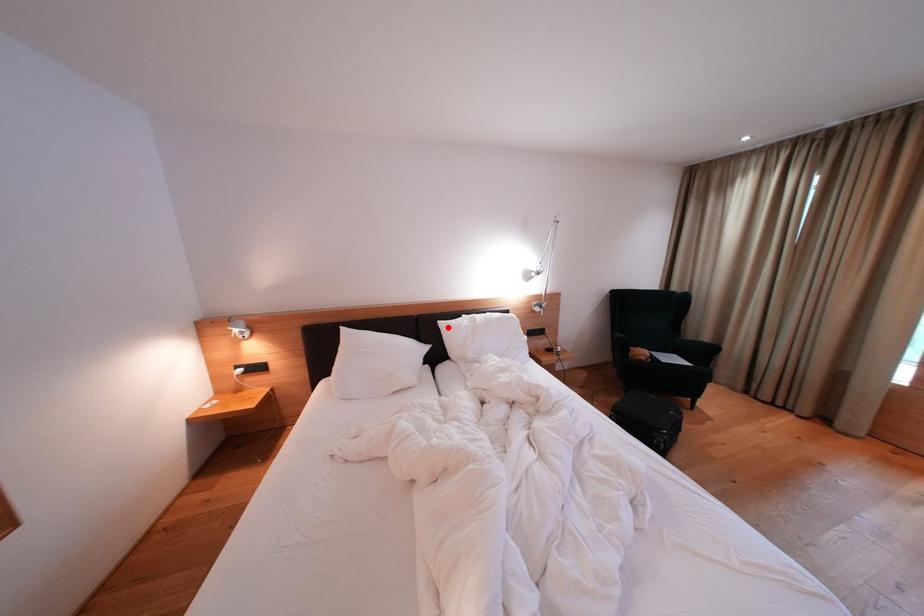
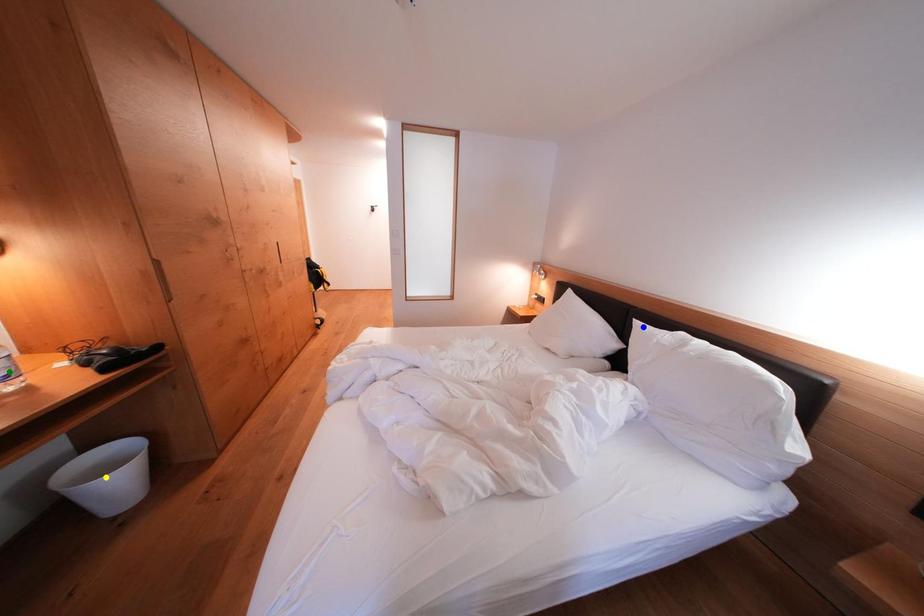
Question: I am providing you with two images of the same scene from different viewpoints. A red point is marked on the first image. You are given multiple points on the second image. Which point in image 2 is actually the same real-world point as the red point in image 1?

Choices:
 (A) green point
 (B) blue point
 (C) yellow point

Answer: (B)